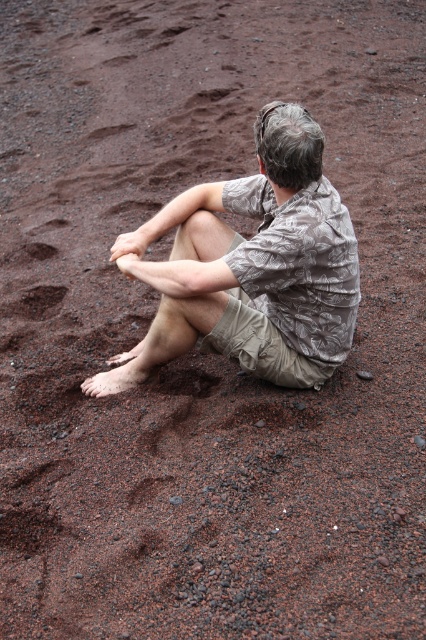
You are standing at the point marked as point [293,248] on the beach. You want to take a photo of the entire beach scene using a camera that has a maximum range of 2.5 meters. Will you be able to capture the entire scene in one shot?

The distance between point [293,248] and the camera is 2.39 meters, which is within the camera maximum range of 2.5 meters. Therefore, you can capture the entire scene in one shot.

You are a photographer trying to capture the scene of a person sitting on the beach. You need to ensure that the camouflage fabric shirt at center and the brown dirt footprint at lower left are both visible in your shot. Given their sizes, which object should you focus on to make sure it fits within the frame first?

The camouflage fabric shirt at center is wider than the brown dirt footprint at lower left, so you should focus on ensuring the camouflage fabric shirt at center fits first since it requires more space in the frame.